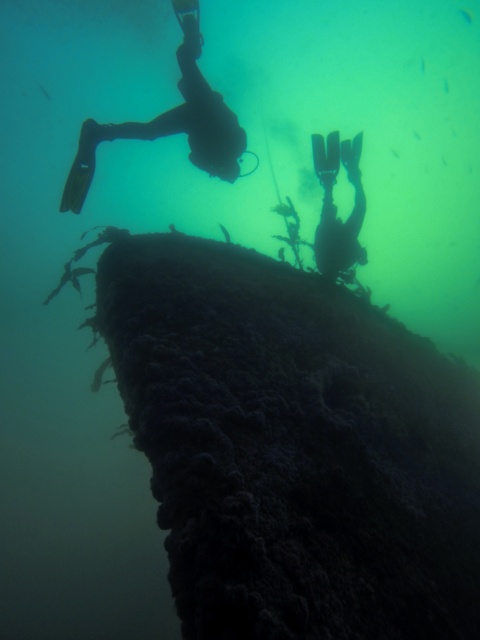
Based on the photo, is black matte scuba diver at upper left to the left of silhouette flippers at center from the viewer's perspective?

Indeed, black matte scuba diver at upper left is positioned on the left side of silhouette flippers at center.

Does black matte scuba diver at upper left lie behind silhouette flippers at center?

No, it is not.

The width and height of the screenshot is (480, 640). What are the coordinates of `black matte scuba diver at upper left` in the screenshot? It's located at (170, 122).

Find the location of a particular element. The image size is (480, 640). black matte scuba diver at upper left is located at coordinates (170, 122).

Is point (431, 550) closer to viewer compared to point (326, 144)?

That is True.

Measure the distance between point (266, 628) and camera.

A distance of 6.46 feet exists between point (266, 628) and camera.

Is point (362, 333) positioned behind point (348, 234)?

No, (362, 333) is closer to viewer.

The height and width of the screenshot is (640, 480). I want to click on rough coral reef at center, so click(x=294, y=448).

Does rough coral reef at center appear on the left side of black matte scuba diver at upper left?

Incorrect, rough coral reef at center is not on the left side of black matte scuba diver at upper left.

Which is above, rough coral reef at center or black matte scuba diver at upper left?

black matte scuba diver at upper left

Image resolution: width=480 pixels, height=640 pixels. I want to click on rough coral reef at center, so click(294, 448).